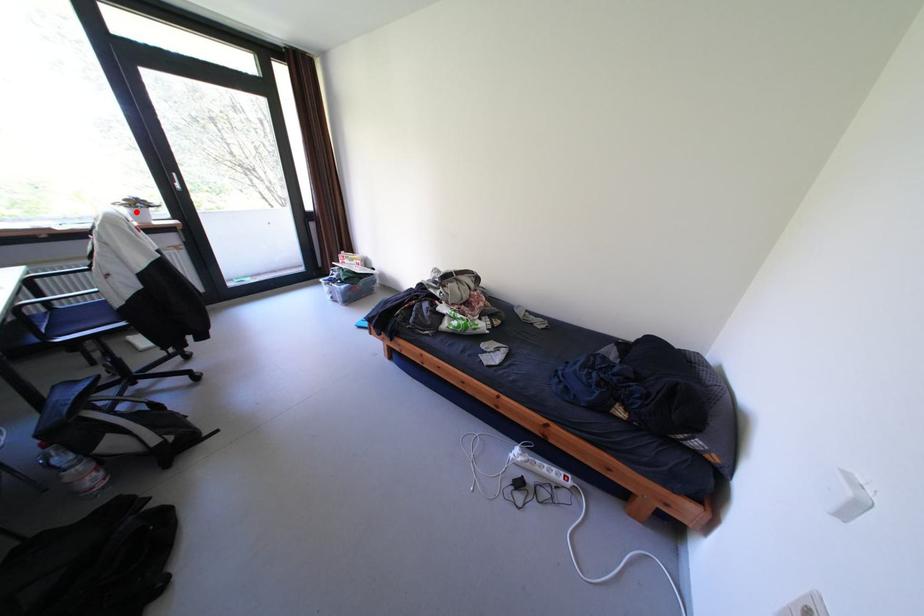
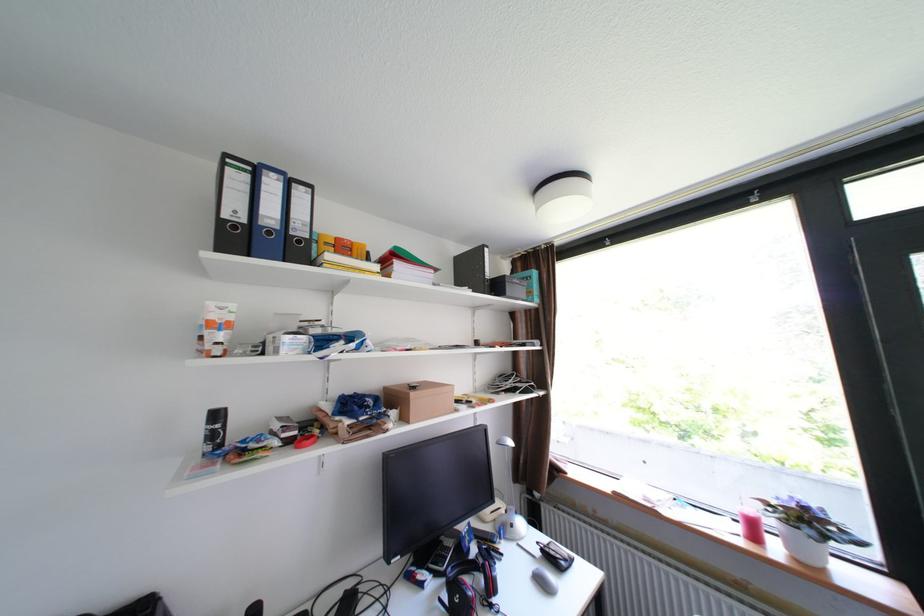
In the second image, find the point that corresponds to the highlighted location in the first image.

(782, 523)